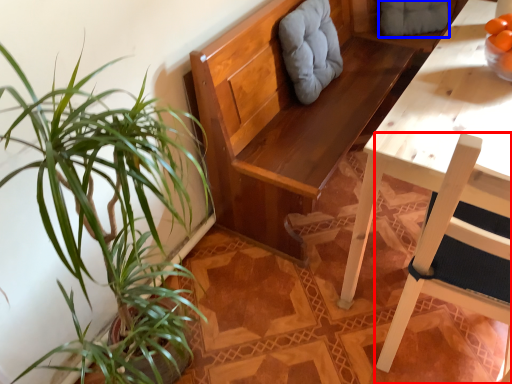
Question: Which of the following is the closest to the observer, chair (highlighted by a red box) or swivel chair (highlighted by a blue box)?

Choices:
 (A) chair
 (B) swivel chair

Answer: (A)